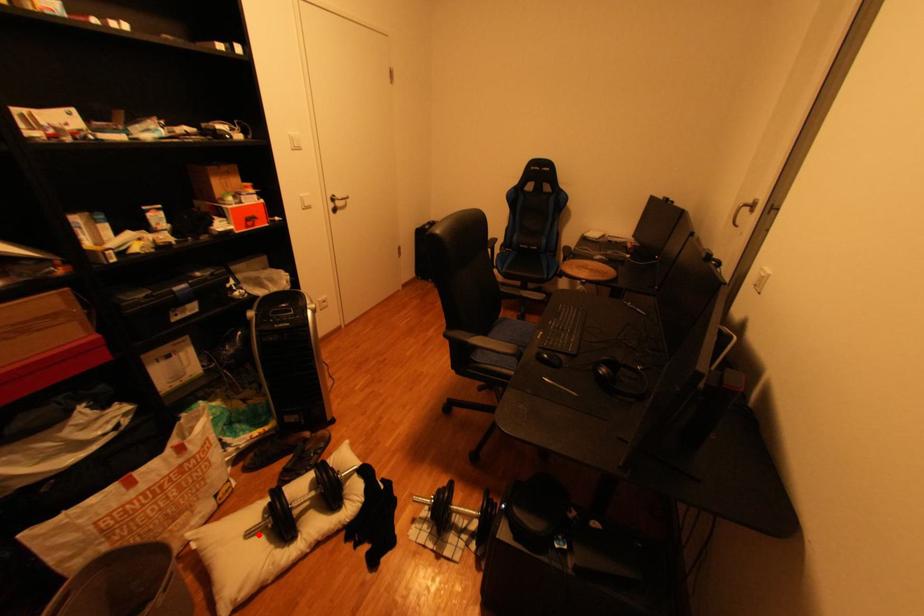
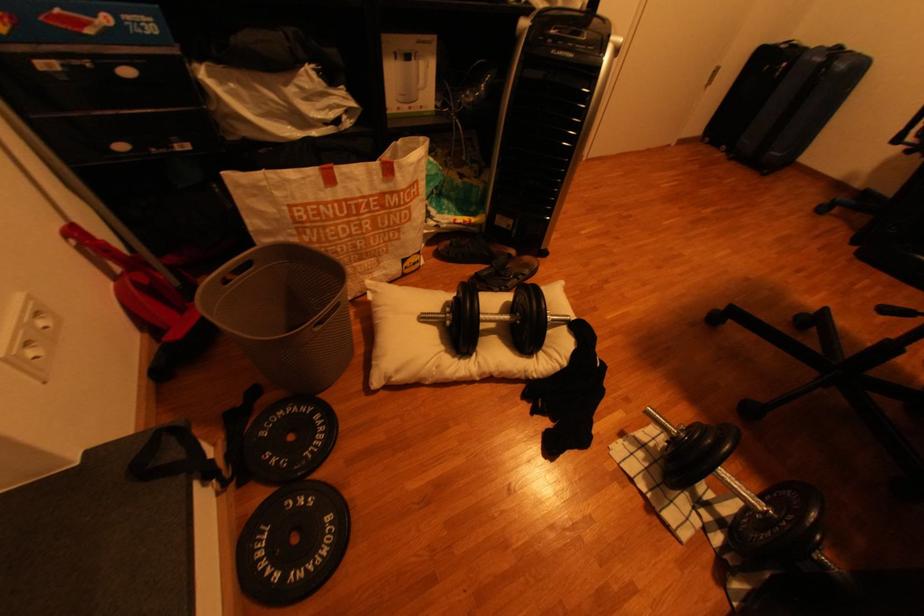
Where in the second image is the point corresponding to the highlighted location from the first image?

(433, 318)